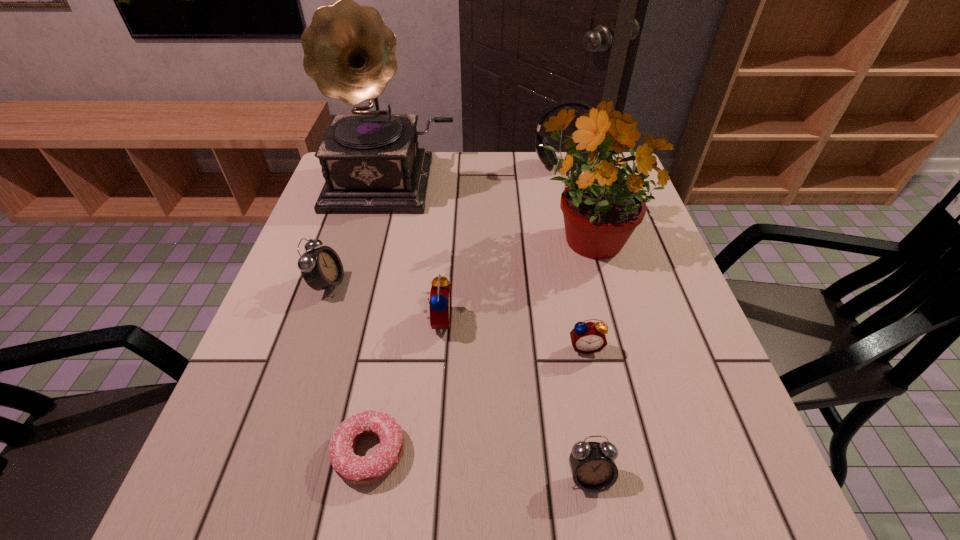
The width and height of the screenshot is (960, 540). Identify the location of the tallest object. (371, 161).

Locate an element on the screen. The height and width of the screenshot is (540, 960). record player is located at coordinates (371, 161).

The height and width of the screenshot is (540, 960). I want to click on red flowerpot, so click(601, 206).

You are a GUI agent. You are given a task and a screenshot of the screen. Output one action in this format:
    pyautogui.click(x=<x>, y=<y>)
    Task: Click on the second tallest object
    
    Given the screenshot: What is the action you would take?
    pyautogui.click(x=601, y=206)

In order to click on the sixth shortest object in this screenshot , I will do `click(547, 157)`.

You are a GUI agent. You are given a task and a screenshot of the screen. Output one action in this format:
    pyautogui.click(x=<x>, y=<y>)
    Task: Click on the headset
    Image resolution: width=960 pixels, height=540 pixels.
    Given the screenshot: What is the action you would take?
    pyautogui.click(x=547, y=157)

Where is `the third nearest alarm clock`? the third nearest alarm clock is located at coordinates (440, 294).

Identify the location of the fourth nearest object. (440, 294).

Where is `the leftmost alarm clock`? The image size is (960, 540). the leftmost alarm clock is located at coordinates (321, 268).

You are a GUI agent. You are given a task and a screenshot of the screen. Output one action in this format:
    pyautogui.click(x=<x>, y=<y>)
    Task: Click on the left white alarm clock
    
    Given the screenshot: What is the action you would take?
    pyautogui.click(x=321, y=268)